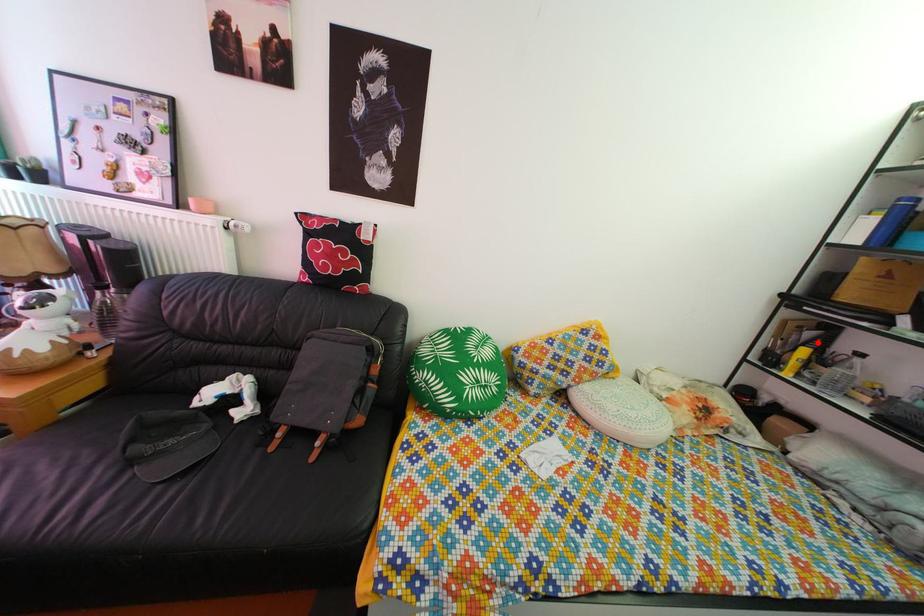
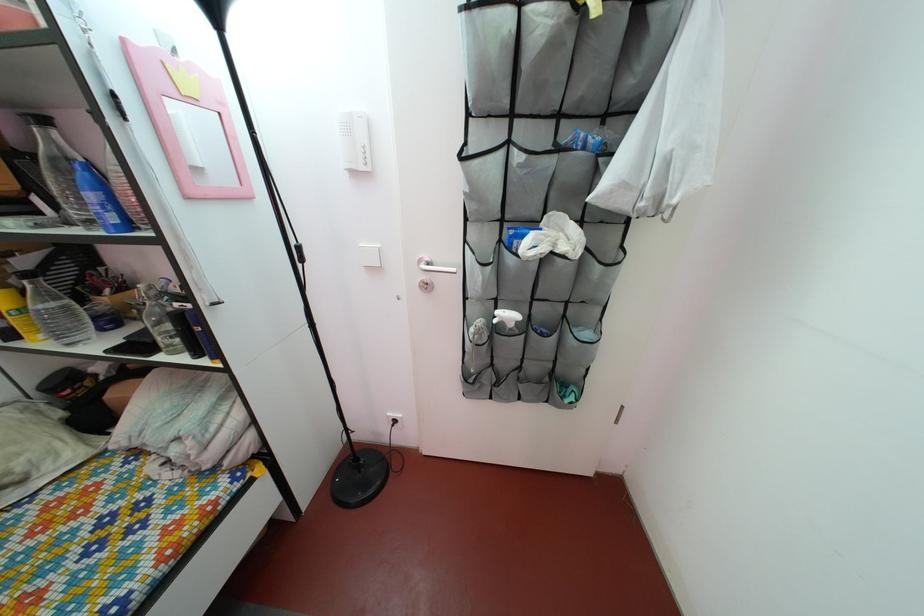
Where in the second image is the point corresponding to the highlighted location from the first image?

(32, 270)